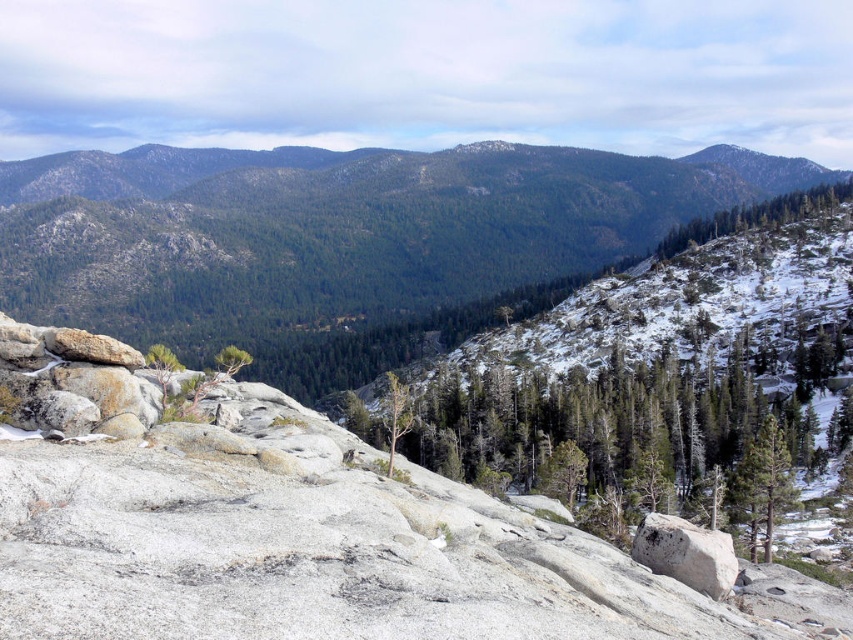
Looking at this image, is rocky terrain at center to the left of gray rough rock at center from the viewer's perspective?

In fact, rocky terrain at center is to the right of gray rough rock at center.

In the scene shown: Is rocky terrain at center in front of gray rough rock at center?

No, rocky terrain at center is behind gray rough rock at center.

Is point (518, 252) positioned after point (680, 579)?

Yes.

The image size is (853, 640). Identify the location of rocky terrain at center. (347, 241).